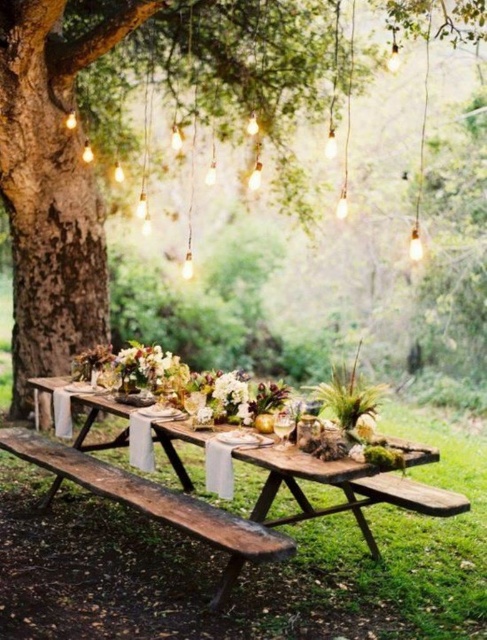
Question: Which point is closer to the camera?

Choices:
 (A) (25, 60)
 (B) (285, 452)

Answer: (B)

Question: Which object appears farthest from the camera in this image?

Choices:
 (A) rustic wooden table at center
 (B) rustic wood picnic table at center

Answer: (B)

Question: Is rustic wood picnic table at center to the right of rustic wooden table at center from the viewer's perspective?

Choices:
 (A) no
 (B) yes

Answer: (B)

Question: Is brown wooden tree trunk at center to the right of rustic wood bench at center from the viewer's perspective?

Choices:
 (A) no
 (B) yes

Answer: (B)

Question: In this image, where is brown wooden tree trunk at center located relative to rustic wood picnic table at center?

Choices:
 (A) above
 (B) below

Answer: (A)

Question: Among these points, which one is farthest from the camera?

Choices:
 (A) (242, 452)
 (B) (157, 499)
 (C) (400, 483)

Answer: (C)